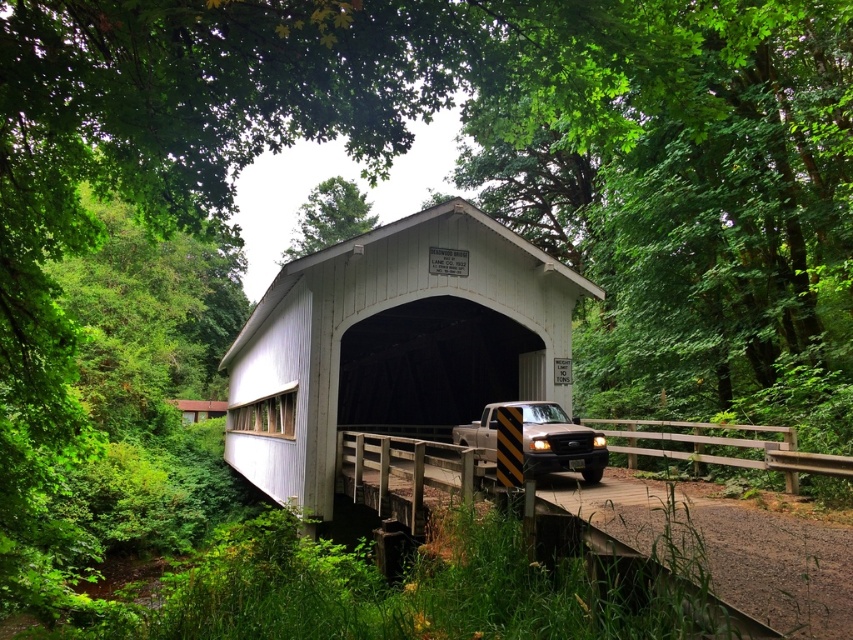
Question: Is white corrugated metal overpass at center to the left of brown matte truck at center from the viewer's perspective?

Choices:
 (A) yes
 (B) no

Answer: (A)

Question: Is white corrugated metal overpass at center thinner than brown matte truck at center?

Choices:
 (A) yes
 (B) no

Answer: (B)

Question: Which point is closer to the camera?

Choices:
 (A) brown matte truck at center
 (B) white corrugated metal overpass at center

Answer: (A)

Question: Among these objects, which one is farthest from the camera?

Choices:
 (A) brown matte truck at center
 (B) white corrugated metal overpass at center

Answer: (B)

Question: Is white corrugated metal overpass at center to the left of brown matte truck at center from the viewer's perspective?

Choices:
 (A) no
 (B) yes

Answer: (B)